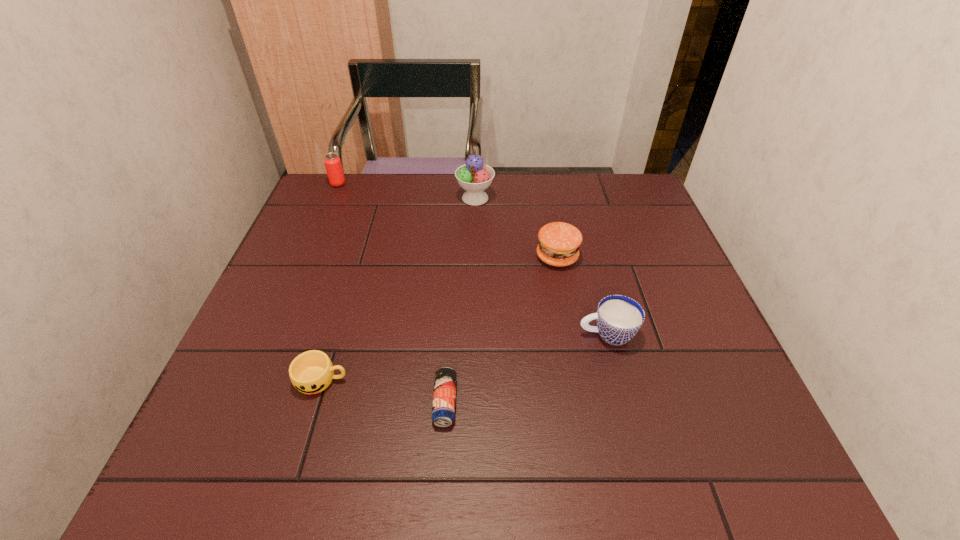
The height and width of the screenshot is (540, 960). I want to click on free spot located 0.280m on the left of the tallest object, so click(366, 198).

Where is `free space located on the front of the leftmost object`? free space located on the front of the leftmost object is located at coordinates (321, 224).

Locate an element on the screen. vacant region located 0.400m on the left of the patty is located at coordinates (385, 257).

Where is `free space located on the side of the taller cup with the handle`? The image size is (960, 540). free space located on the side of the taller cup with the handle is located at coordinates (425, 334).

Locate an element on the screen. vacant area situated on the side of the taller cup with the handle is located at coordinates (542, 334).

The image size is (960, 540). I want to click on vacant space located on the side of the taller cup with the handle, so click(475, 334).

Identify the location of vacant space situated on the right of the nearer cup. (500, 380).

The height and width of the screenshot is (540, 960). I want to click on blank space located on the back of the right beer can, so click(451, 302).

The width and height of the screenshot is (960, 540). What are the coordinates of `icecream that is at the far edge` in the screenshot? It's located at (474, 176).

Identify the location of beer can that is at the far edge. This screenshot has width=960, height=540. (332, 162).